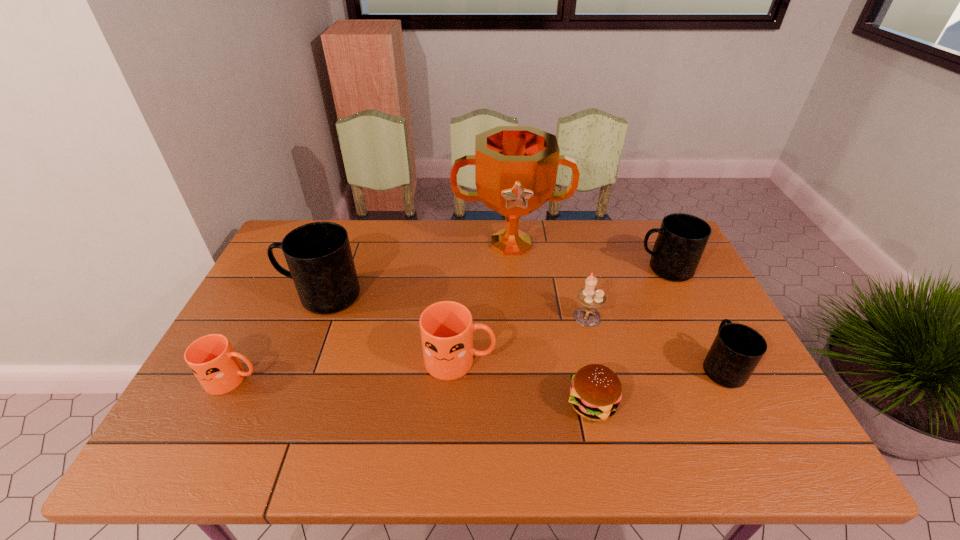
In order to click on vacant area located 0.230m on the side of the smallest black mug with the handle in this screenshot , I will do `click(681, 287)`.

Find the location of a particular element. The image size is (960, 540). free point located on the handle side of the smaller orange mug is located at coordinates (330, 379).

Locate an element on the screen. The height and width of the screenshot is (540, 960). vacant region located 0.170m on the left of the brown hamburger is located at coordinates (492, 404).

Identify the location of award at the far edge. (516, 167).

Identify the location of mug at the far edge. (682, 238).

I want to click on object at the near edge, so click(596, 391).

Where is `object at the far right corner`? The height and width of the screenshot is (540, 960). object at the far right corner is located at coordinates (682, 238).

Identify the location of vacant space at the far edge. (465, 259).

Where is `free space at the near edge of the desktop`? This screenshot has height=540, width=960. free space at the near edge of the desktop is located at coordinates (328, 436).

This screenshot has width=960, height=540. I want to click on vacant area at the left edge, so click(x=241, y=348).